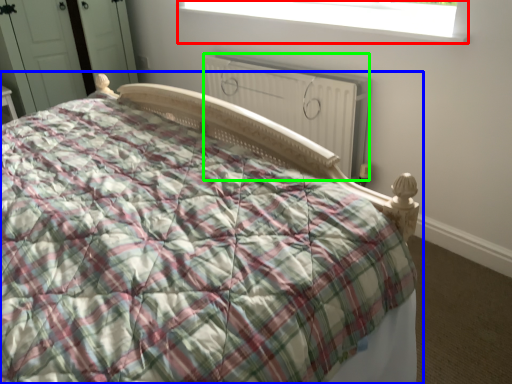
Question: Which object is the closest to the window (highlighted by a red box)? Choose among these: bed (highlighted by a blue box) or radiator (highlighted by a green box).

Choices:
 (A) bed
 (B) radiator

Answer: (B)